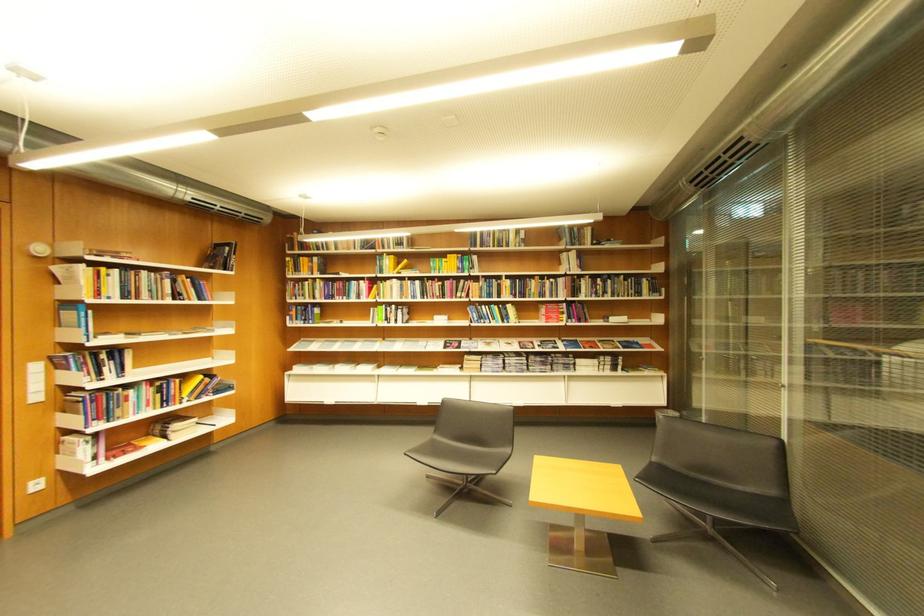
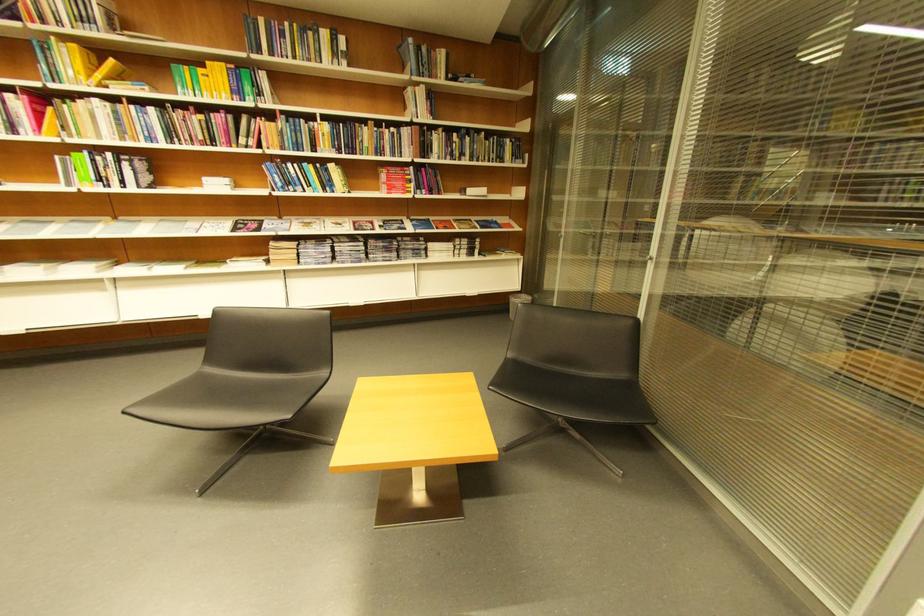
Where in the second image is the point corresponding to point (561, 308) from the first image?

(403, 172)